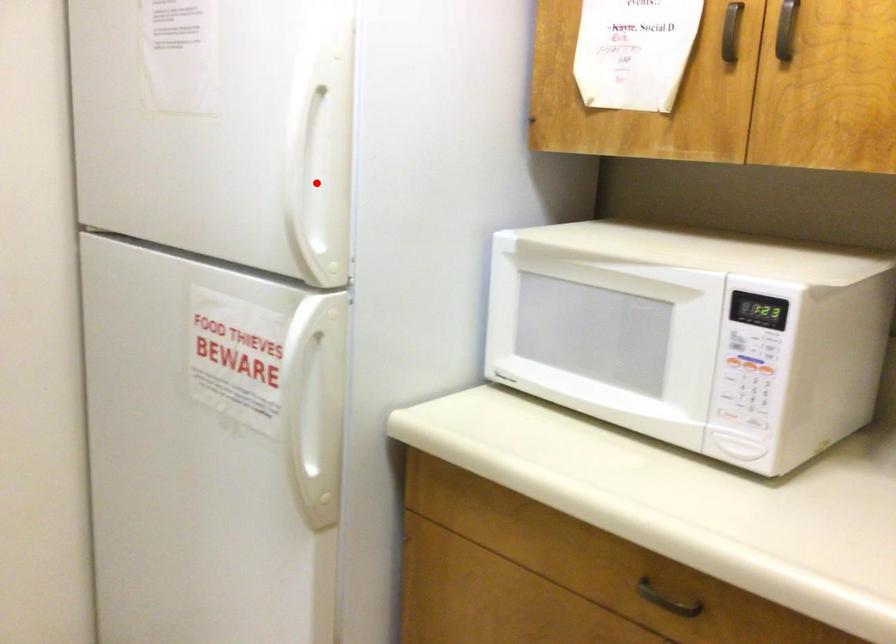
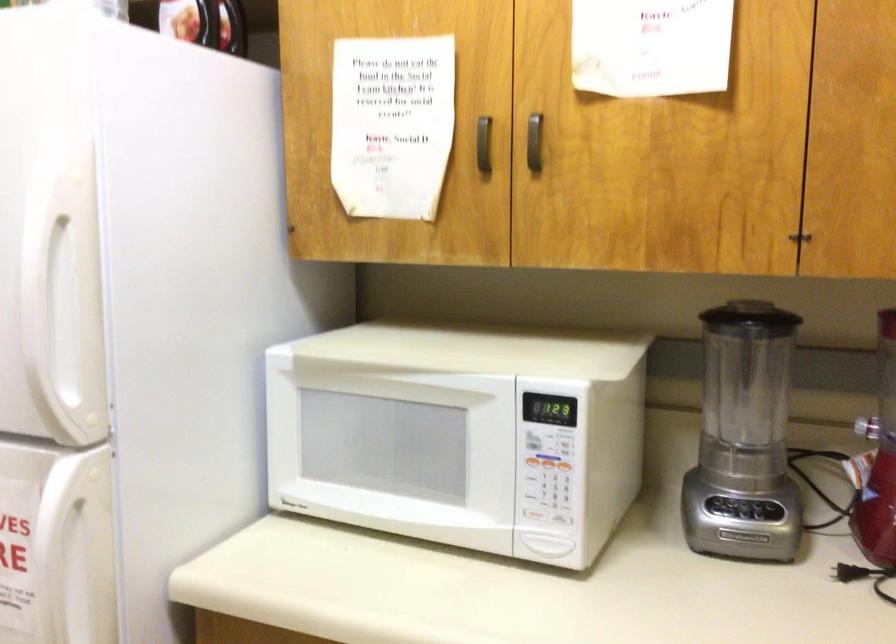
Question: I am providing you with two images of the same scene from different viewpoints. In image1, a red point is highlighted. Considering the same 3D point in image2, which of the following is correct?

Choices:
 (A) It is closer
 (B) It is farther

Answer: (A)